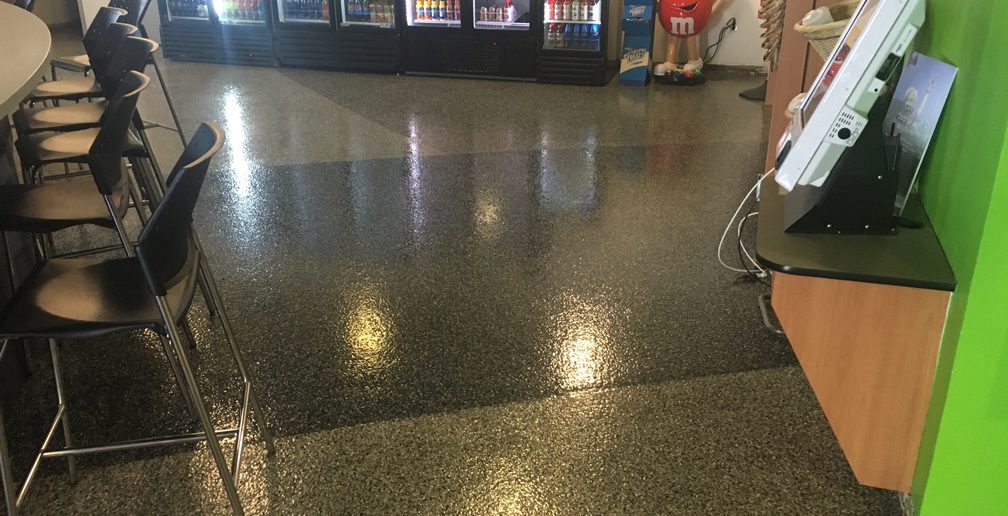
This screenshot has height=516, width=1008. I want to click on basket, so click(x=824, y=36).